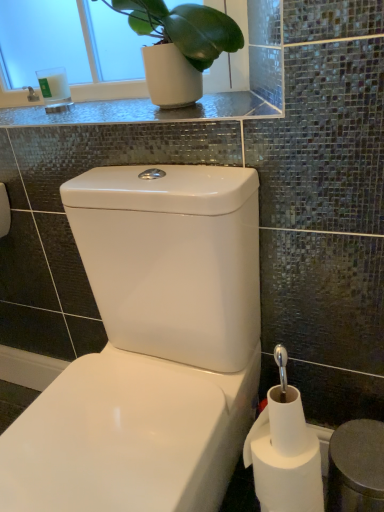
Question: Considering the relative sizes of shiny glass countertop at upper center and green matte plant at upper left in the image provided, is shiny glass countertop at upper center thinner than green matte plant at upper left?

Choices:
 (A) no
 (B) yes

Answer: (A)

Question: From the image's perspective, is shiny glass countertop at upper center located above green matte plant at upper left?

Choices:
 (A) yes
 (B) no

Answer: (B)

Question: Does shiny glass countertop at upper center touch green matte plant at upper left?

Choices:
 (A) no
 (B) yes

Answer: (A)

Question: From a real-world perspective, is shiny glass countertop at upper center positioned under green matte plant at upper left based on gravity?

Choices:
 (A) no
 (B) yes

Answer: (B)

Question: Is shiny glass countertop at upper center to the right of green matte plant at upper left from the viewer's perspective?

Choices:
 (A) yes
 (B) no

Answer: (B)

Question: From a real-world perspective, is white matte toilet paper at lower right above or below white glass candle at upper left?

Choices:
 (A) below
 (B) above

Answer: (A)

Question: Would you say white matte toilet paper at lower right is inside or outside white glass candle at upper left?

Choices:
 (A) outside
 (B) inside

Answer: (A)

Question: In terms of size, does white matte toilet paper at lower right appear bigger or smaller than white glass candle at upper left?

Choices:
 (A) small
 (B) big

Answer: (B)

Question: From their relative heights in the image, would you say white matte toilet paper at lower right is taller or shorter than white glass candle at upper left?

Choices:
 (A) short
 (B) tall

Answer: (B)

Question: From their relative heights in the image, would you say white matte toilet paper at lower right is taller or shorter than green matte plant at upper left?

Choices:
 (A) short
 (B) tall

Answer: (A)

Question: In terms of width, does white matte toilet paper at lower right look wider or thinner when compared to green matte plant at upper left?

Choices:
 (A) thin
 (B) wide

Answer: (A)

Question: Considering their positions, is white matte toilet paper at lower right located in front of or behind green matte plant at upper left?

Choices:
 (A) front
 (B) behind

Answer: (A)

Question: Is point (311, 481) closer or farther from the camera than point (150, 23)?

Choices:
 (A) closer
 (B) farther

Answer: (A)

Question: Considering the relative positions of shiny glass countertop at upper center and green matte plant at upper left in the image provided, is shiny glass countertop at upper center to the left or to the right of green matte plant at upper left?

Choices:
 (A) right
 (B) left

Answer: (B)

Question: Considering the positions of shiny glass countertop at upper center and green matte plant at upper left in the image, is shiny glass countertop at upper center wider or thinner than green matte plant at upper left?

Choices:
 (A) thin
 (B) wide

Answer: (B)